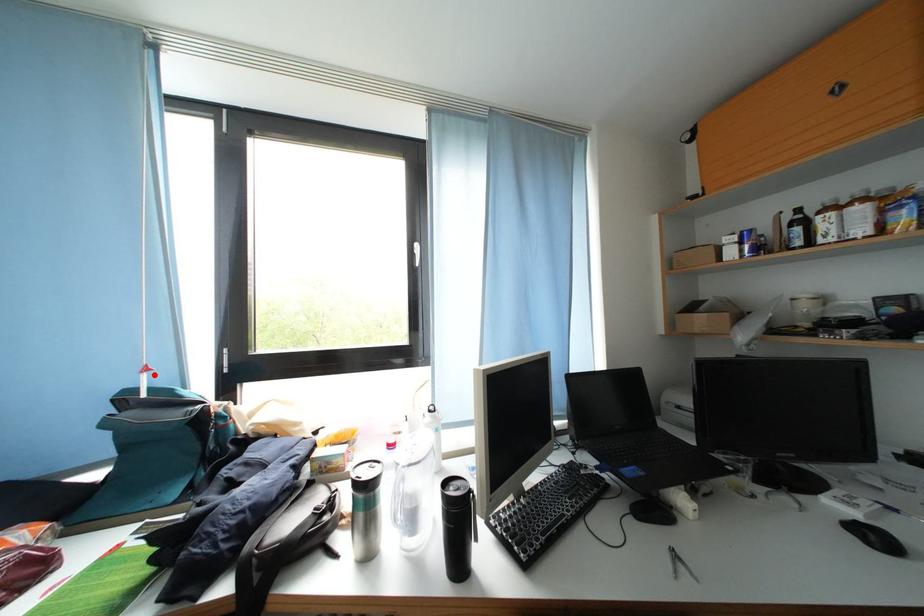
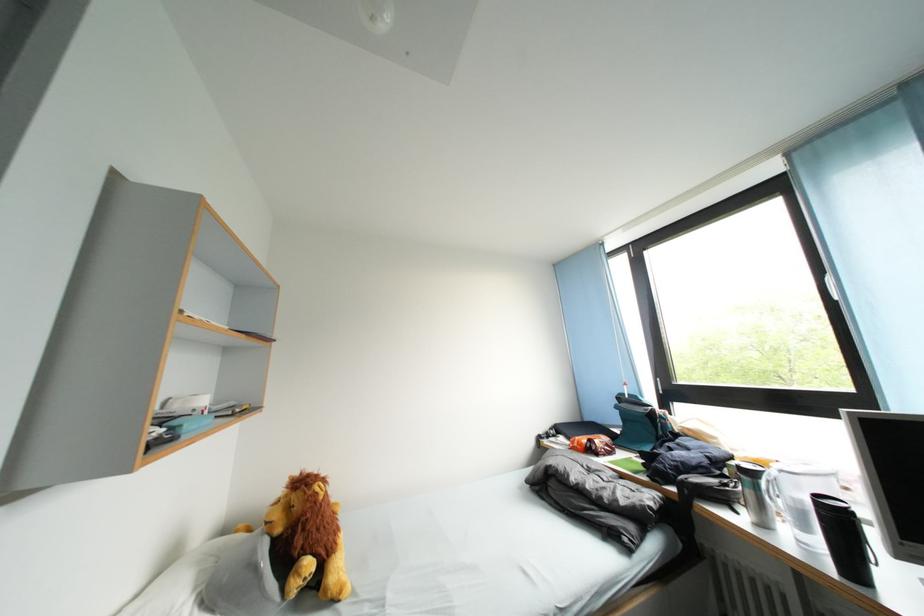
Where in the second image is the point corresponding to the highlighted location from the first image?

(634, 389)